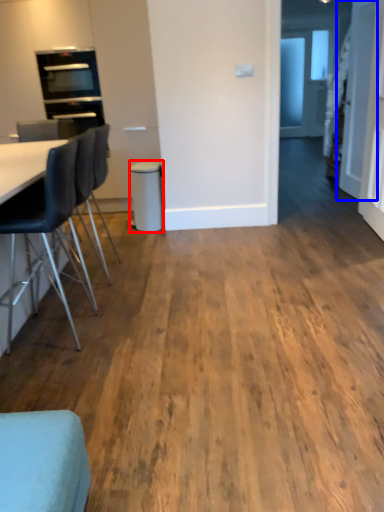
Question: Which of the following is the closest to the observer, bar stool (highlighted by a red box) or door (highlighted by a blue box)?

Choices:
 (A) bar stool
 (B) door

Answer: (B)